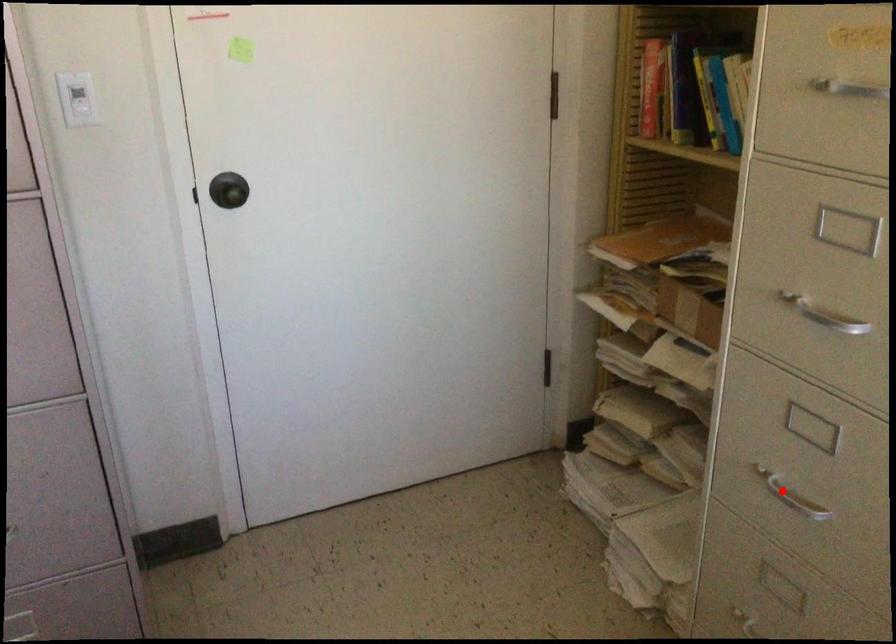
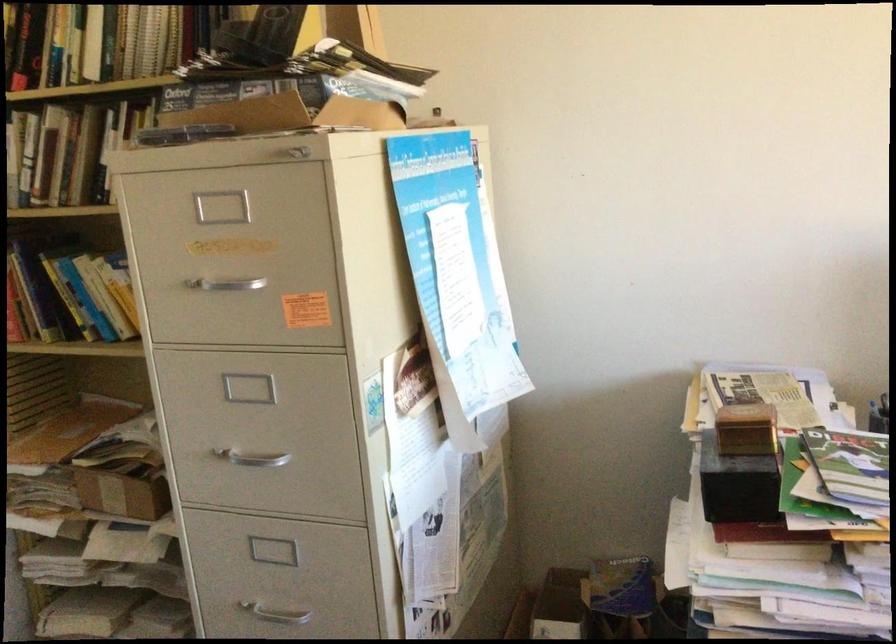
Find the pixel in the second image that matches the highlighted location in the first image.

(273, 608)